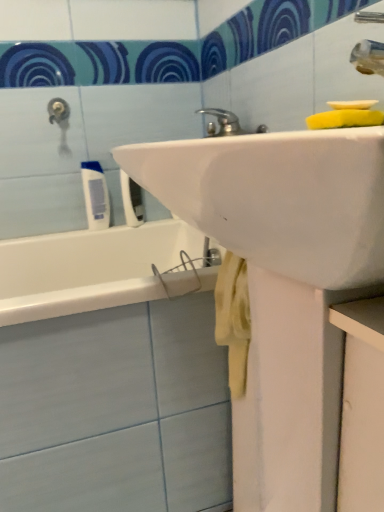
Question: Should I look upward or downward to see white matte tube at left, placed as the second toiletry when sorted from right to left?

Choices:
 (A) up
 (B) down

Answer: (A)

Question: From a real-world perspective, is white matte tube at left, positioned as the first toiletry in left-to-right order, positioned under yellow sponge at upper right based on gravity?

Choices:
 (A) no
 (B) yes

Answer: (B)

Question: Considering the relative sizes of white matte tube at left, positioned as the first toiletry in left-to-right order, and yellow sponge at upper right in the image provided, is white matte tube at left, positioned as the first toiletry in left-to-right order, bigger than yellow sponge at upper right?

Choices:
 (A) yes
 (B) no

Answer: (A)

Question: From the image's perspective, does white matte tube at left, placed as the second toiletry when sorted from right to left, appear lower than yellow sponge at upper right?

Choices:
 (A) no
 (B) yes

Answer: (B)

Question: Does white matte tube at left, placed as the second toiletry when sorted from right to left, have a greater width compared to yellow sponge at upper right?

Choices:
 (A) yes
 (B) no

Answer: (B)

Question: Is there a large distance between white matte tube at left, positioned as the first toiletry in left-to-right order, and yellow sponge at upper right?

Choices:
 (A) yes
 (B) no

Answer: (B)

Question: Is the depth of white matte tube at left, placed as the second toiletry when sorted from right to left, greater than that of yellow sponge at upper right?

Choices:
 (A) no
 (B) yes

Answer: (B)

Question: Considering the relative positions of yellow sponge at upper right and white plastic toothbrush at upper left, which is the 1th toiletry in right-to-left order, in the image provided, is yellow sponge at upper right behind white plastic toothbrush at upper left, which is the 1th toiletry in right-to-left order,?

Choices:
 (A) yes
 (B) no

Answer: (B)

Question: Is yellow sponge at upper right smaller than white plastic toothbrush at upper left, the 2th toiletry in the left-to-right sequence?

Choices:
 (A) no
 (B) yes

Answer: (B)

Question: Is white plastic toothbrush at upper left, which is the 1th toiletry in right-to-left order, at the back of yellow sponge at upper right?

Choices:
 (A) yes
 (B) no

Answer: (B)

Question: From a real-world perspective, does yellow sponge at upper right stand above white plastic toothbrush at upper left, which is the 1th toiletry in right-to-left order?

Choices:
 (A) no
 (B) yes

Answer: (B)

Question: Are yellow sponge at upper right and white plastic toothbrush at upper left, the 2th toiletry in the left-to-right sequence, far apart?

Choices:
 (A) no
 (B) yes

Answer: (A)

Question: Is yellow sponge at upper right in front of white plastic toothbrush at upper left, the 2th toiletry in the left-to-right sequence?

Choices:
 (A) no
 (B) yes

Answer: (B)